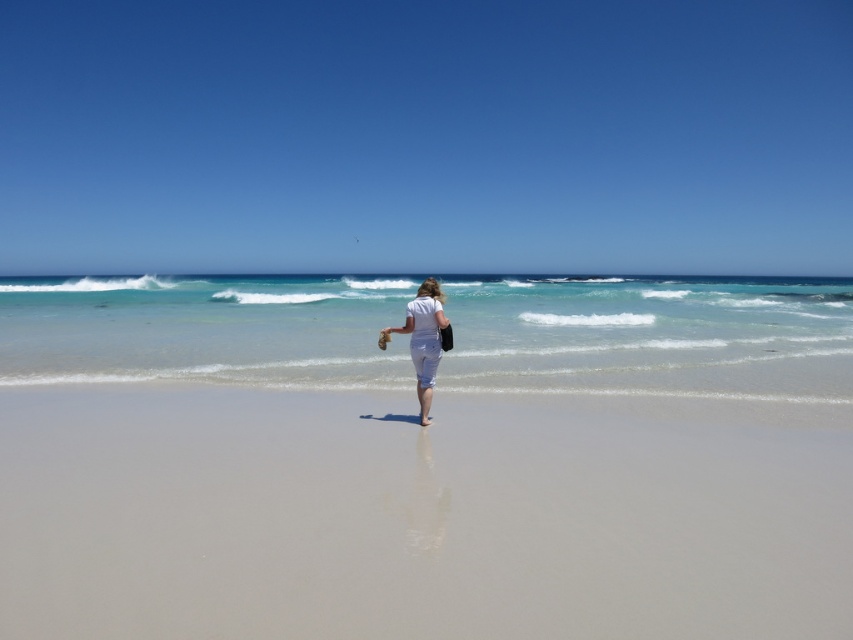
You are standing on the beach and want to place a small seashell exactly at the point marked as point (428, 509). Based on the scene description, what type of surface will the seashell be placed on?

The seashell will be placed on smooth sand at center, as the description states that at point (428, 509) lies smooth sand at center.

You are standing on the beach in the image and want to take a photo of the clear blue water at center. Where should you point your camera to capture it?

You should point your camera towards the center of the image at coordinates approximately 0.522 on the x axis and 0.763 on the y axis to capture the clear blue water at center.